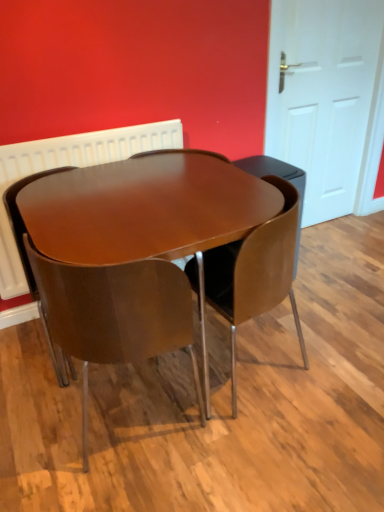
Where is `unoccupied area in front of matte brown chair at center, acting as the 2th chair starting from the left`? unoccupied area in front of matte brown chair at center, acting as the 2th chair starting from the left is located at coordinates (132, 482).